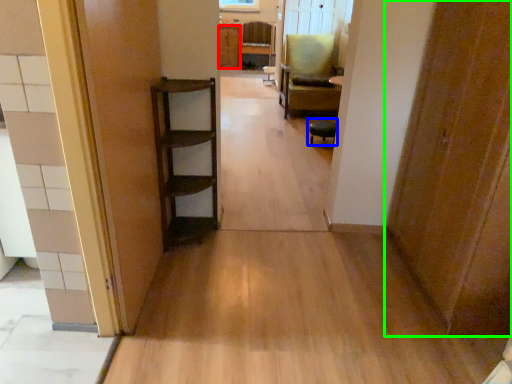
Question: Based on their relative distances, which object is farther from cabinetry (highlighted by a red box)? Choose from furniture (highlighted by a blue box) and door (highlighted by a green box).

Choices:
 (A) furniture
 (B) door

Answer: (B)